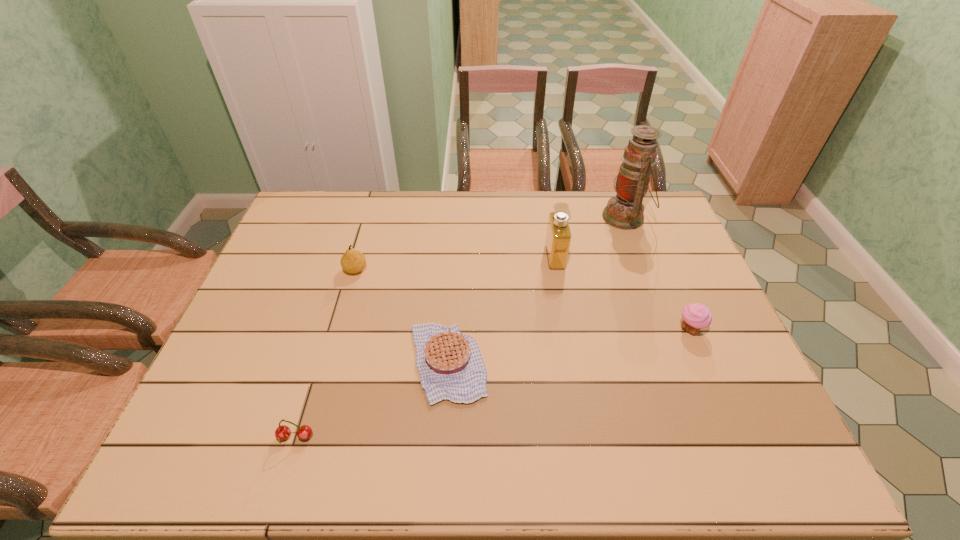
At what (x,y) coordinates should I click in order to perform the action: click on blank region between the cupcake and the fourth shortest object. Please return your answer as a coordinate pair (x, y). Looking at the image, I should click on (523, 300).

The width and height of the screenshot is (960, 540). I want to click on free area in between the cherry and the pear, so click(x=325, y=353).

The image size is (960, 540). Identify the location of vacant region between the third tallest object and the pie. (401, 316).

You are a GUI agent. You are given a task and a screenshot of the screen. Output one action in this format:
    pyautogui.click(x=<x>, y=<y>)
    Task: Click on the free space between the farthest object and the cupcake
    This screenshot has width=960, height=540.
    Given the screenshot: What is the action you would take?
    pyautogui.click(x=658, y=273)

Image resolution: width=960 pixels, height=540 pixels. What are the coordinates of `blank region between the cupcake and the tallest object` in the screenshot? It's located at (658, 273).

Identify the location of object that is the fifth closest one to the cupcake. (304, 432).

Locate an element on the screen. This screenshot has width=960, height=540. the second closest object to the oil lamp is located at coordinates (696, 316).

At what (x,y) coordinates should I click in order to perform the action: click on free space that satisfies the following two spatial constraints: 1. on the front side of the oil lamp; 2. on the front-facing side of the third object from right to left. Please return your answer as a coordinate pair (x, y). The width and height of the screenshot is (960, 540). Looking at the image, I should click on (640, 257).

Locate an element on the screen. This screenshot has width=960, height=540. vacant space that satisfies the following two spatial constraints: 1. on the front-facing side of the cupcake; 2. on the left side of the perfume is located at coordinates (568, 329).